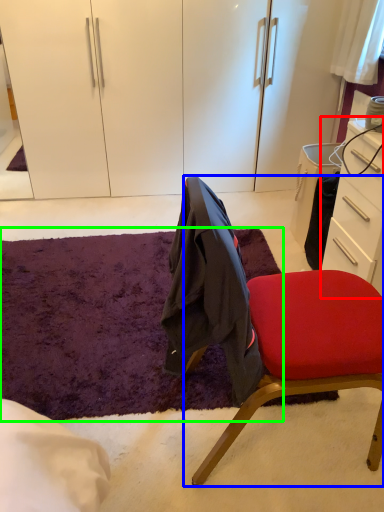
Question: Which is farther away from desk (highlighted by a red box)? chair (highlighted by a blue box) or mat (highlighted by a green box)?

Choices:
 (A) chair
 (B) mat

Answer: (B)